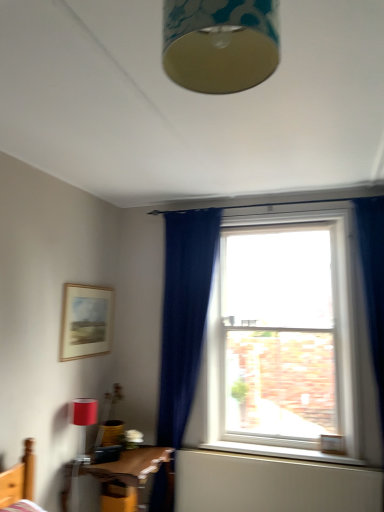
Question: Does matte gold lampshade at upper center have a lesser width compared to matte wooden picture frame at upper left?

Choices:
 (A) no
 (B) yes

Answer: (A)

Question: Does matte gold lampshade at upper center touch matte wooden picture frame at upper left?

Choices:
 (A) yes
 (B) no

Answer: (B)

Question: Does matte gold lampshade at upper center have a smaller size compared to matte wooden picture frame at upper left?

Choices:
 (A) no
 (B) yes

Answer: (A)

Question: From the image's perspective, is matte gold lampshade at upper center located above matte wooden picture frame at upper left?

Choices:
 (A) yes
 (B) no

Answer: (A)

Question: Considering the relative sizes of matte gold lampshade at upper center and matte wooden picture frame at upper left in the image provided, is matte gold lampshade at upper center bigger than matte wooden picture frame at upper left?

Choices:
 (A) yes
 (B) no

Answer: (A)

Question: Looking at the image, does matte red lampshade at lower left seem bigger or smaller compared to matte gold lampshade at upper center?

Choices:
 (A) small
 (B) big

Answer: (A)

Question: Considering the relative positions of matte red lampshade at lower left and matte gold lampshade at upper center in the image provided, is matte red lampshade at lower left to the left or to the right of matte gold lampshade at upper center?

Choices:
 (A) left
 (B) right

Answer: (A)

Question: From the image's perspective, is matte red lampshade at lower left above or below matte gold lampshade at upper center?

Choices:
 (A) above
 (B) below

Answer: (B)

Question: Is point click(81, 443) positioned closer to the camera than point click(241, 76)?

Choices:
 (A) closer
 (B) farther

Answer: (B)

Question: Is white wooden window sill at lower center bigger or smaller than wooden table at lower left?

Choices:
 (A) small
 (B) big

Answer: (A)

Question: Considering the positions of white wooden window sill at lower center and wooden table at lower left in the image, is white wooden window sill at lower center taller or shorter than wooden table at lower left?

Choices:
 (A) short
 (B) tall

Answer: (A)

Question: Is white wooden window sill at lower center inside or outside of wooden table at lower left?

Choices:
 (A) outside
 (B) inside

Answer: (A)

Question: In the image, is white wooden window sill at lower center positioned in front of or behind wooden table at lower left?

Choices:
 (A) behind
 (B) front

Answer: (A)

Question: From a real-world perspective, is matte wooden picture frame at upper left physically located above or below matte gold lampshade at upper center?

Choices:
 (A) above
 (B) below

Answer: (B)

Question: From the image's perspective, is matte wooden picture frame at upper left located above or below matte gold lampshade at upper center?

Choices:
 (A) above
 (B) below

Answer: (B)